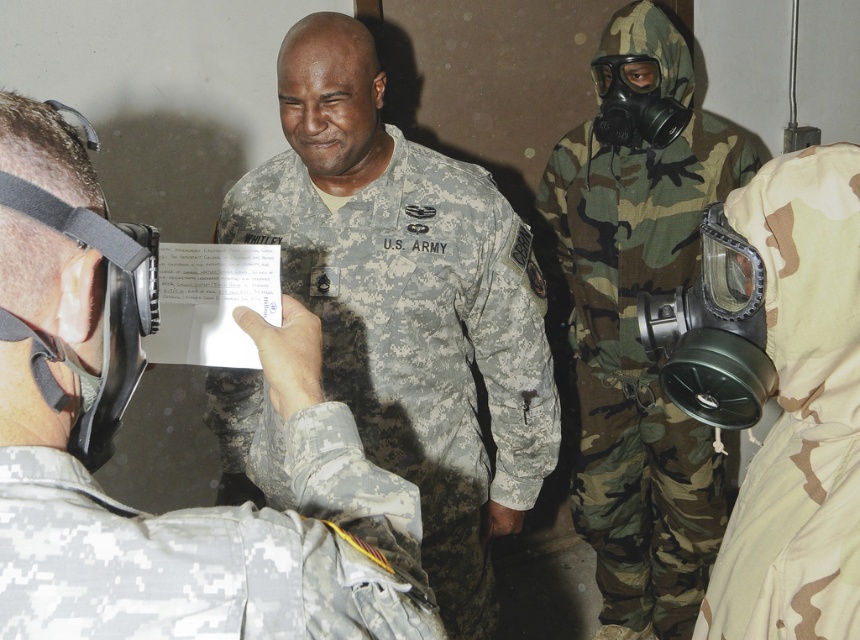
Question: Can you confirm if camouflage fabric us army uniform at center is positioned to the left of camo fabric gas mask at right?

Choices:
 (A) no
 (B) yes

Answer: (B)

Question: Is camouflage uniform at center to the right of camouflage fabric us army uniform at center from the viewer's perspective?

Choices:
 (A) yes
 (B) no

Answer: (B)

Question: Based on their relative distances, which object is farther from the camouflage uniform at center?

Choices:
 (A) camo fabric gas mask at right
 (B) camouflage fabric gas mask at right
 (C) camouflage fabric us army uniform at center

Answer: (A)

Question: Where is camouflage uniform at center located in relation to camouflage fabric gas mask at right in the image?

Choices:
 (A) below
 (B) above

Answer: (B)

Question: Among these points, which one is farthest from the camera?

Choices:
 (A) (839, 369)
 (B) (605, 392)
 (C) (376, 461)
 (D) (130, 611)

Answer: (B)

Question: Which point appears farthest from the camera in this image?

Choices:
 (A) (538, 397)
 (B) (716, 164)

Answer: (B)